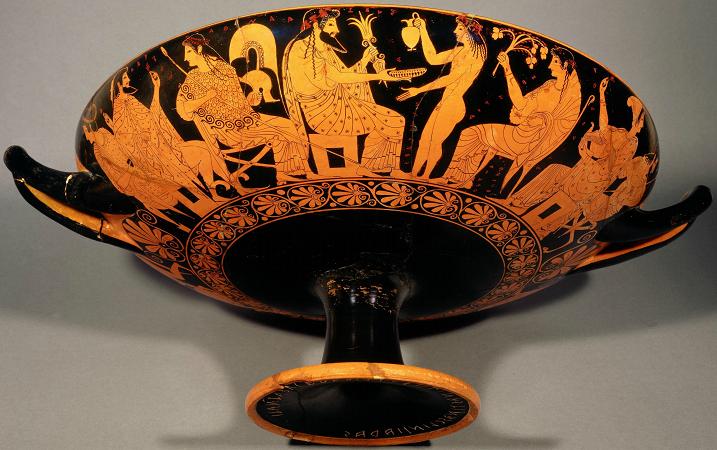
The width and height of the screenshot is (717, 450). What are the coordinates of `jug` in the screenshot? It's located at (409, 35).